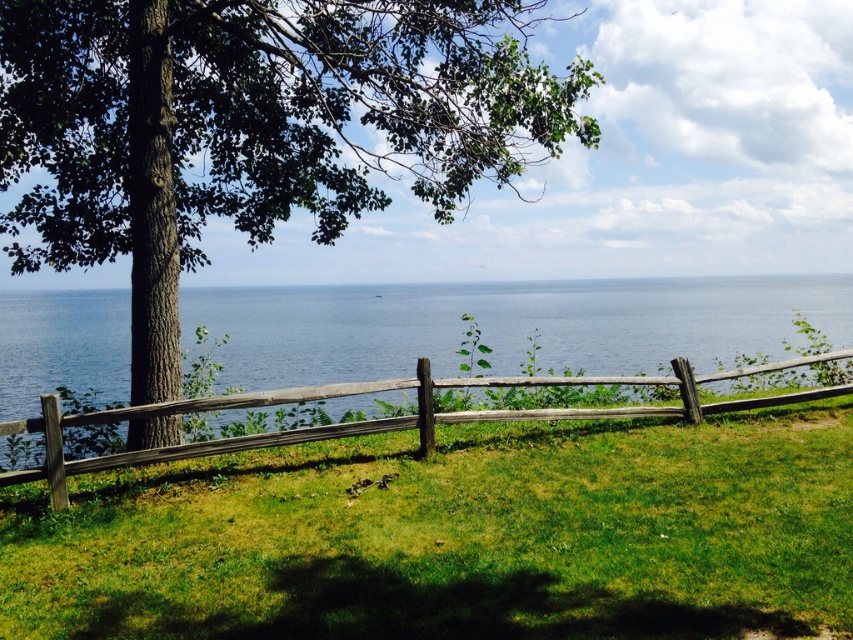
You are a gardener who needs to mow the green grassy at center. The lawnmower you are using has a 3 meter long extension cord plugged into the house. Can you reach the wooden split rail fence at center with the lawnmower without unplugging the cord?

The green grassy at center and wooden split rail fence at center are 2.91 meters apart. Since the extension cord is 3 meters long, the lawnmower can reach the wooden split rail fence at center without unplugging the cord.

You are a gardener standing in the middle of the green grassy at center. You want to walk to the green rough bark tree at center. Which direction should you move to reach it?

The green grassy at center is positioned on the left side of the green rough bark tree at center, so you should move to the right to reach the green rough bark tree at center.

You are a gardener planning to mow the green grassy at center. You need to know if the wooden split rail fence at center is in the way. Can you determine if the fence is larger than the grassy area?

The green grassy at center is smaller than the wooden split rail fence at center, so the fence is larger than the grassy area. Therefore, the wooden split rail fence at center may be in the way of mowing the green grassy at center.